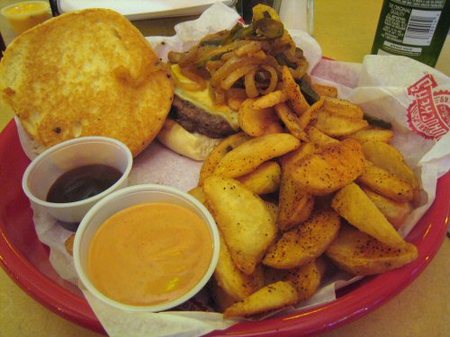
Locate an element on the screen. Image resolution: width=450 pixels, height=337 pixels. table is located at coordinates (425, 302).